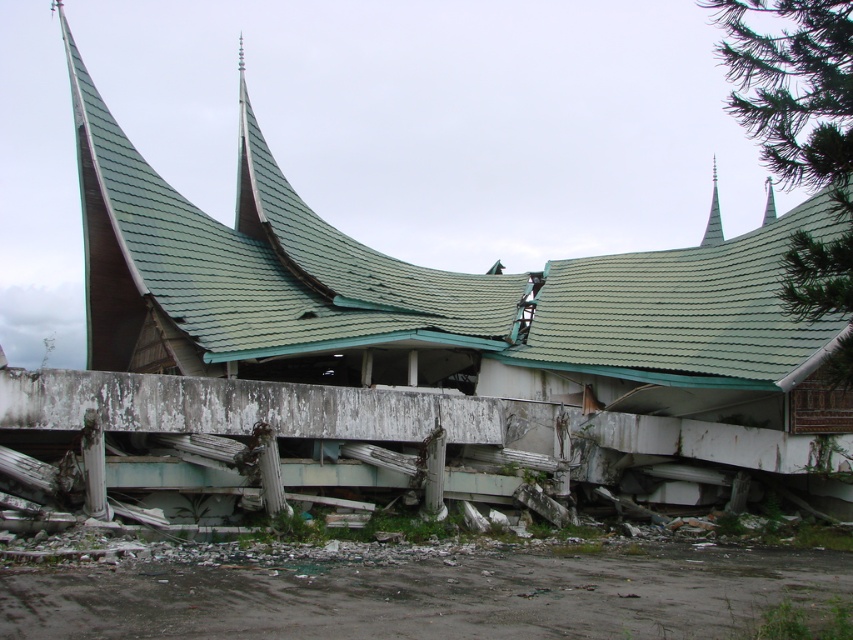
You are an architect examining the damaged building. You notice two spires at the upper center of the structure. Which spire is closer to you, the green tile spire at upper center or the green shingled spire at upper center?

The green tile spire at upper center is closer to you because it is positioned in front of the green shingled spire at upper center.

You are standing at the point marked as point (712, 216) in the image. Looking around, you see the green tile spire at upper center. Is the green tile spire at upper center directly above you?

The green tile spire at upper center is located at point 0.337, 0.837, so yes, it is directly above you.

You are a drone operator trying to capture aerial footage of the green tile spire at upper center. Your drone has a maximum flight range of 100 meters. Given the coordinates of the spire at point 0.339, 0.837, can you estimate if your drone can reach it from your current position?

The green tile spire at upper center is located at coordinates (712, 216). Since the drone has a maximum flight range of 100 meters, it can easily reach the spire from your current position as the distance is well within the range.